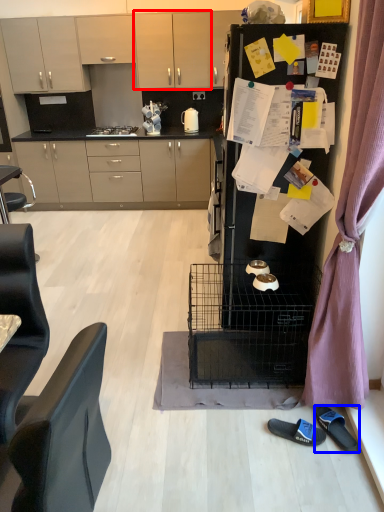
Question: Which object is closer to the camera taking this photo, cabinetry (highlighted by a red box) or footwear (highlighted by a blue box)?

Choices:
 (A) cabinetry
 (B) footwear

Answer: (B)